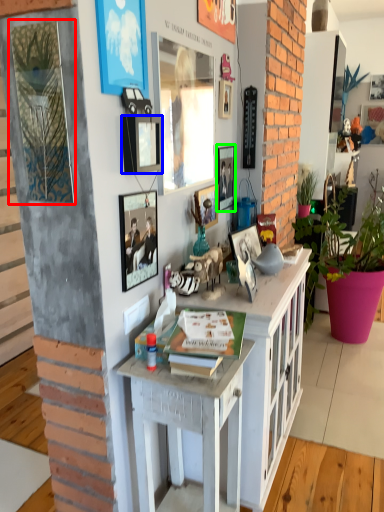
Question: Considering the real-world distances, which object is closest to picture frame (highlighted by a red box)? picture frame (highlighted by a blue box) or picture frame (highlighted by a green box).

Choices:
 (A) picture frame
 (B) picture frame

Answer: (A)